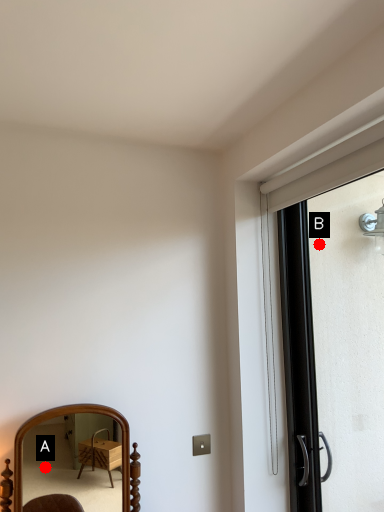
Question: Two points are circled on the image, labeled by A and B beside each circle. Which point is closer to the camera?

Choices:
 (A) A is closer
 (B) B is closer

Answer: (B)